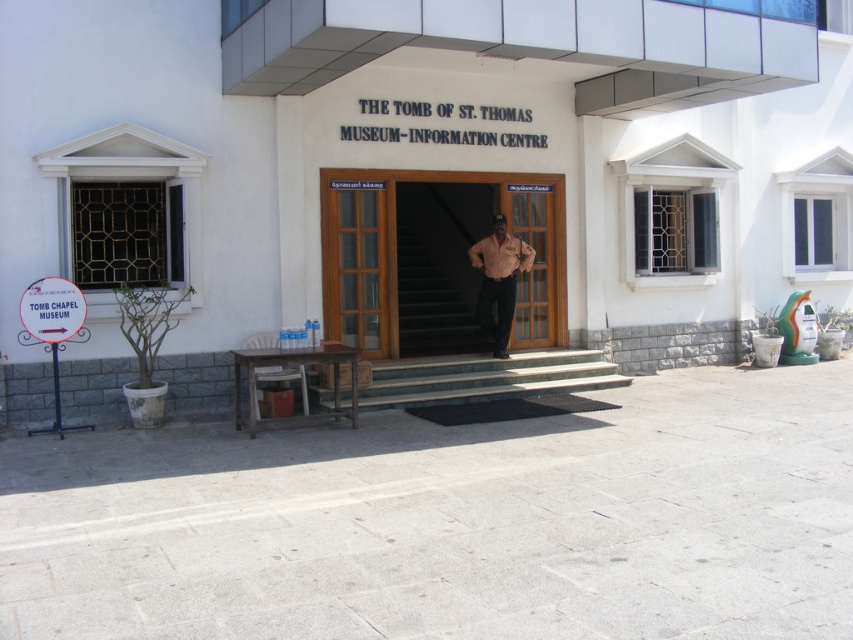
In the scene shown: Is brown wooden door at center below matte beige shirt at center?

Incorrect, brown wooden door at center is not positioned below matte beige shirt at center.

Does brown wooden door at center have a lesser width compared to matte beige shirt at center?

No, brown wooden door at center is not thinner than matte beige shirt at center.

Between point (541, 230) and point (502, 314), which one is positioned in front?

Point (502, 314) is more forward.

This screenshot has width=853, height=640. In order to click on brown wooden door at center in this screenshot , I will do `click(436, 259)`.